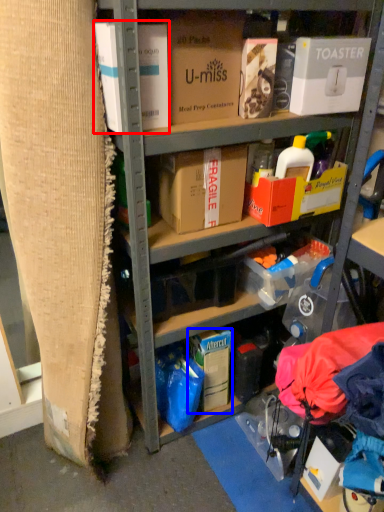
Question: Which of the following is the closest to the observer, box (highlighted by a red box) or storage box (highlighted by a blue box)?

Choices:
 (A) box
 (B) storage box

Answer: (A)